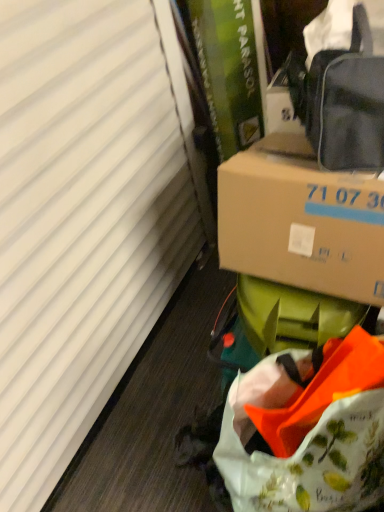
Question: Is white matte curtain at left a part of matte black bag at upper right?

Choices:
 (A) no
 (B) yes

Answer: (A)

Question: Is matte black bag at upper right in front of white matte curtain at left?

Choices:
 (A) yes
 (B) no

Answer: (B)

Question: Is matte black bag at upper right to the right of white matte curtain at left from the viewer's perspective?

Choices:
 (A) yes
 (B) no

Answer: (A)

Question: From the image's perspective, is matte black bag at upper right on white matte curtain at left?

Choices:
 (A) no
 (B) yes

Answer: (B)

Question: Is matte black bag at upper right at the left side of white matte curtain at left?

Choices:
 (A) no
 (B) yes

Answer: (A)

Question: From a real-world perspective, is matte black bag at upper right positioned under white matte curtain at left based on gravity?

Choices:
 (A) no
 (B) yes

Answer: (A)

Question: Considering the relative sizes of brown cardboard box at center-right and white matte curtain at left in the image provided, is brown cardboard box at center-right thinner than white matte curtain at left?

Choices:
 (A) no
 (B) yes

Answer: (A)

Question: From a real-world perspective, is brown cardboard box at center-right over white matte curtain at left?

Choices:
 (A) no
 (B) yes

Answer: (B)

Question: From a real-world perspective, is brown cardboard box at center-right under white matte curtain at left?

Choices:
 (A) yes
 (B) no

Answer: (B)

Question: Would you say white matte curtain at left is part of brown cardboard box at center-right's contents?

Choices:
 (A) yes
 (B) no

Answer: (B)

Question: Can you confirm if brown cardboard box at center-right is smaller than white matte curtain at left?

Choices:
 (A) no
 (B) yes

Answer: (B)

Question: Considering the relative positions of brown cardboard box at center-right and white matte curtain at left in the image provided, is brown cardboard box at center-right to the left of white matte curtain at left from the viewer's perspective?

Choices:
 (A) yes
 (B) no

Answer: (B)

Question: From the image's perspective, is matte black bag at upper right on top of floral printed fabric bag at lower right?

Choices:
 (A) no
 (B) yes

Answer: (B)